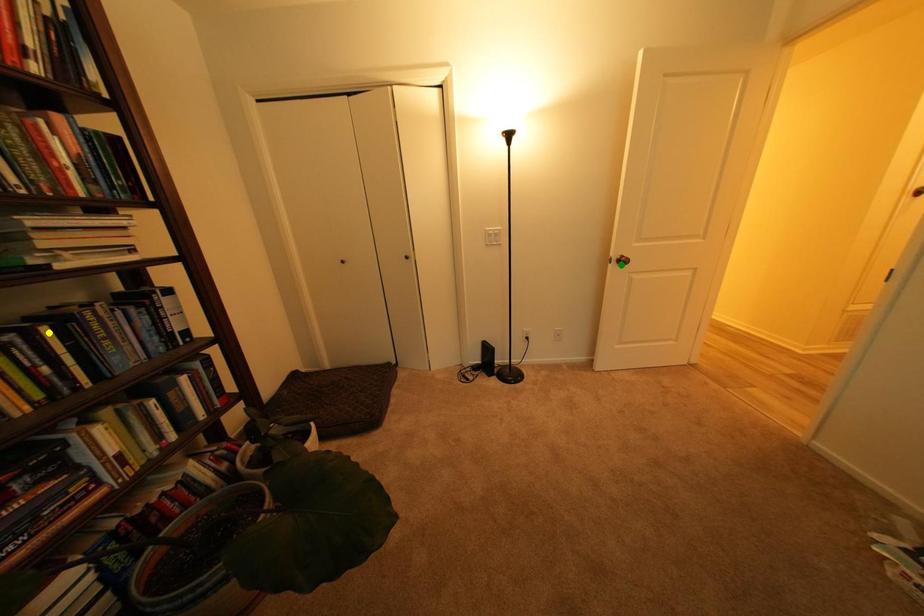
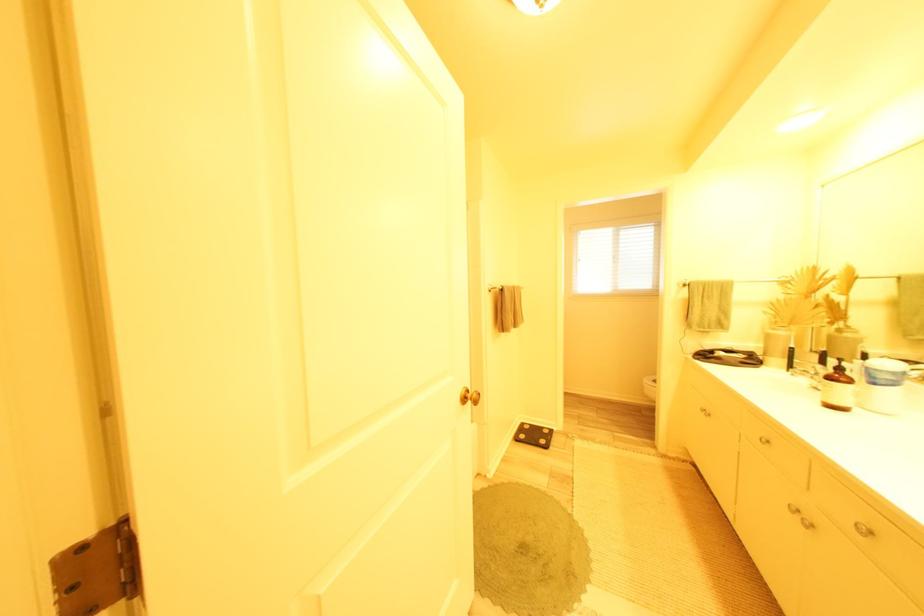
I am providing you with two images of the same scene from different viewpoints. Three points are marked in image1. Which point corresponds to a part or object that is occluded in image2?In image1, three points are marked. Which of them correspond to a part or object that is occluded in image2?Among the three points shown in image1, which one corresponds to a part or object that is no longer visible due to occlusion in image2?

blue point, yellow point, green point cannot be seen in image2.